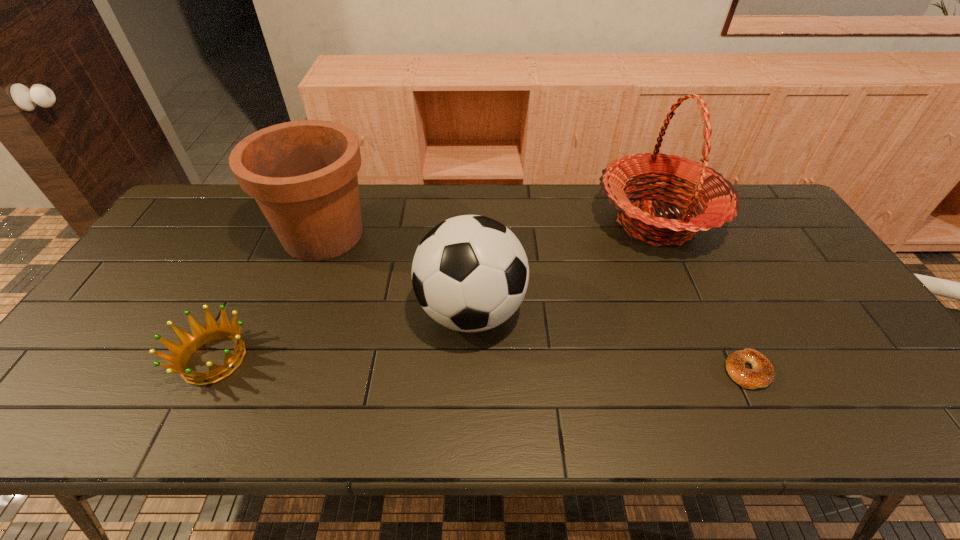
Image resolution: width=960 pixels, height=540 pixels. Identify the location of the tallest object. (720, 200).

Identify the location of flowerpot. (303, 174).

Find the location of a particular element. This screenshot has width=960, height=540. soccer ball is located at coordinates (470, 273).

Locate an element on the screen. crown is located at coordinates (190, 343).

Where is `the shortest object`? the shortest object is located at coordinates (762, 374).

Identify the location of free space located on the front of the tallest object. This screenshot has width=960, height=540. (694, 309).

Where is `free space located on the right of the flowerpot`? free space located on the right of the flowerpot is located at coordinates (470, 235).

You are a GUI agent. You are given a task and a screenshot of the screen. Output one action in this format:
    pyautogui.click(x=<x>, y=<y>)
    Task: Click on the free spot located on the back of the soccer ball
    Image resolution: width=960 pixels, height=540 pixels.
    Given the screenshot: What is the action you would take?
    pyautogui.click(x=472, y=249)

You are a GUI agent. You are given a task and a screenshot of the screen. Output one action in this format:
    pyautogui.click(x=<x>, y=<y>)
    Task: Click on the vacant space located on the right of the crown
    
    Given the screenshot: What is the action you would take?
    pyautogui.click(x=402, y=359)

Image resolution: width=960 pixels, height=540 pixels. What are the coordinates of `free space located 0.150m on the left of the shortest object` in the screenshot? It's located at (660, 370).